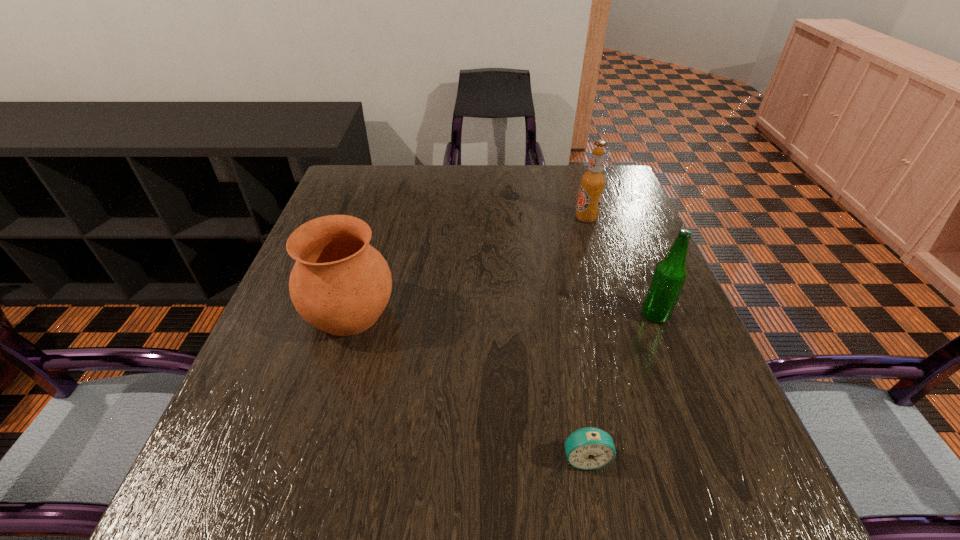
Identify the location of vacant space in between the left beer bottle and the third object from right to left. pos(586,338).

Where is `vacant space that's between the nearer beer bottle and the farther beer bottle`? The width and height of the screenshot is (960, 540). vacant space that's between the nearer beer bottle and the farther beer bottle is located at coordinates (620, 266).

The image size is (960, 540). Find the location of `object that is the third closest to the right beer bottle`. object that is the third closest to the right beer bottle is located at coordinates (340, 284).

What are the coordinates of `object that can be found as the third closest to the third object from left to right` in the screenshot? It's located at (588, 448).

The width and height of the screenshot is (960, 540). Identify the location of free space that satisfies the following two spatial constraints: 1. on the front label of the farther beer bottle; 2. on the front-facing side of the nearest object. (661, 457).

Locate an element on the screen. The height and width of the screenshot is (540, 960). vacant area that satisfies the following two spatial constraints: 1. on the front label of the second object from right to left; 2. on the front-facing side of the nearest object is located at coordinates (661, 457).

At what (x,y) coordinates should I click in order to perform the action: click on vacant area that satisfies the following two spatial constraints: 1. on the front label of the farther beer bottle; 2. on the front-facing side of the shortest object. Please return your answer as a coordinate pair (x, y). The height and width of the screenshot is (540, 960). Looking at the image, I should click on (661, 457).

You are a GUI agent. You are given a task and a screenshot of the screen. Output one action in this format:
    pyautogui.click(x=<x>, y=<y>)
    Task: Click on the free spot that satisfies the following two spatial constraints: 1. on the front label of the left beer bottle; 2. on the front-facing side of the nearest object
    This screenshot has width=960, height=540.
    Given the screenshot: What is the action you would take?
    pyautogui.click(x=661, y=457)